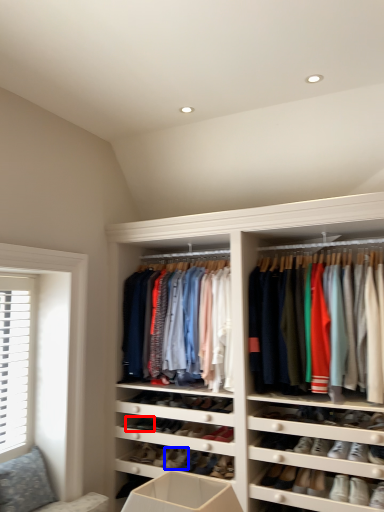
Question: Which object is closer to the camera taking this photo, shoe (highlighted by a red box) or shoe (highlighted by a blue box)?

Choices:
 (A) shoe
 (B) shoe

Answer: (B)